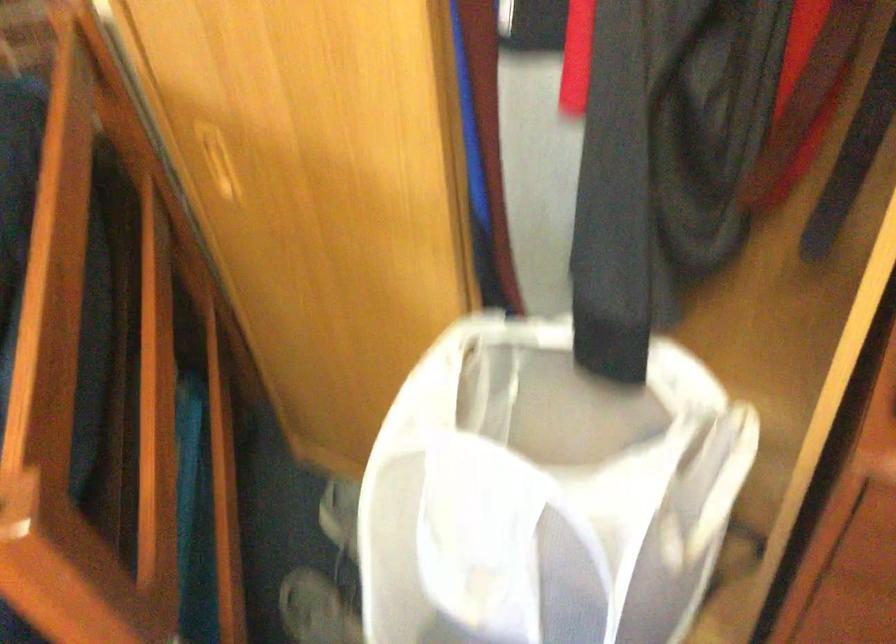
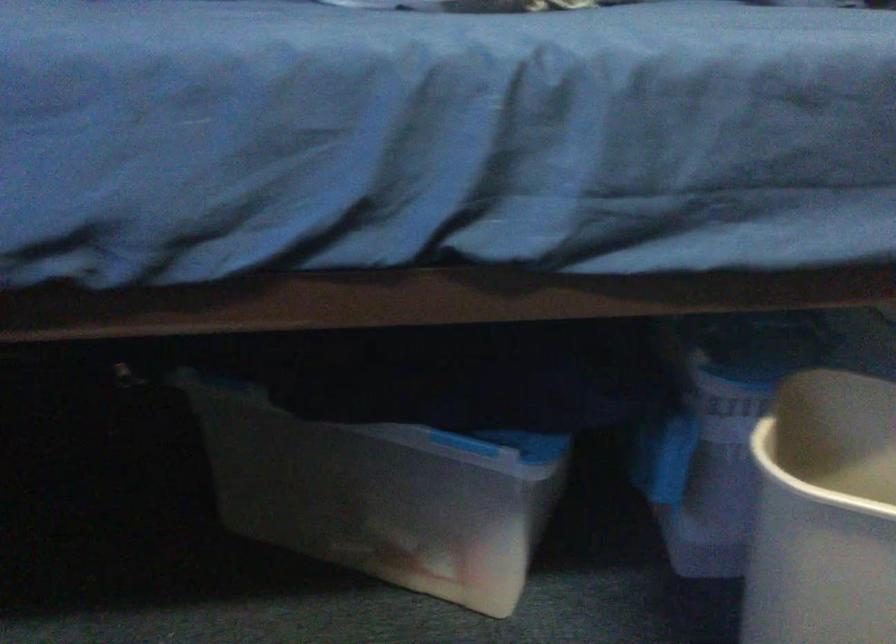
Question: Which direction would the cameraman need to move to produce the second image? Reply with the corresponding letter.

Choices:
 (A) Left
 (B) Right
 (C) Forward
 (D) Backward

Answer: (A)